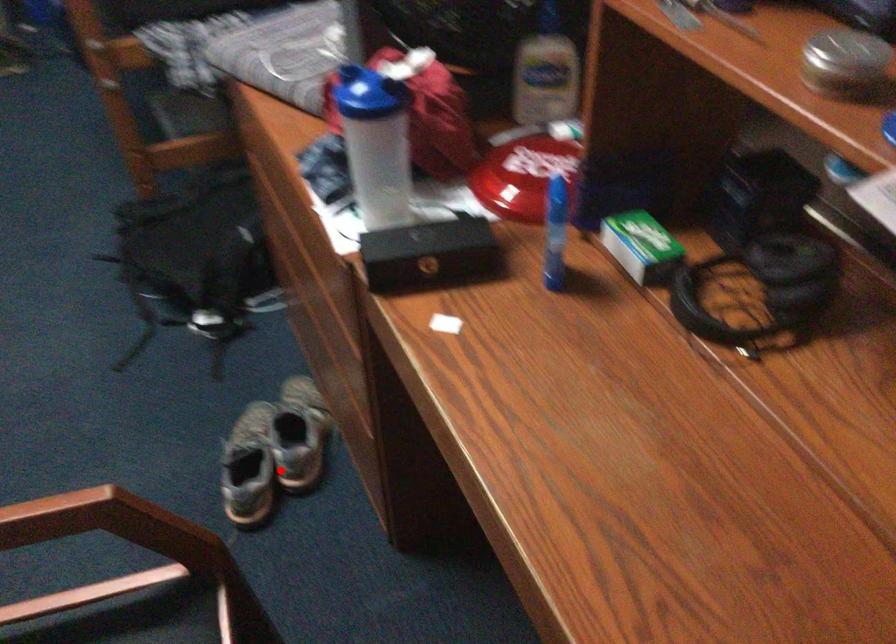
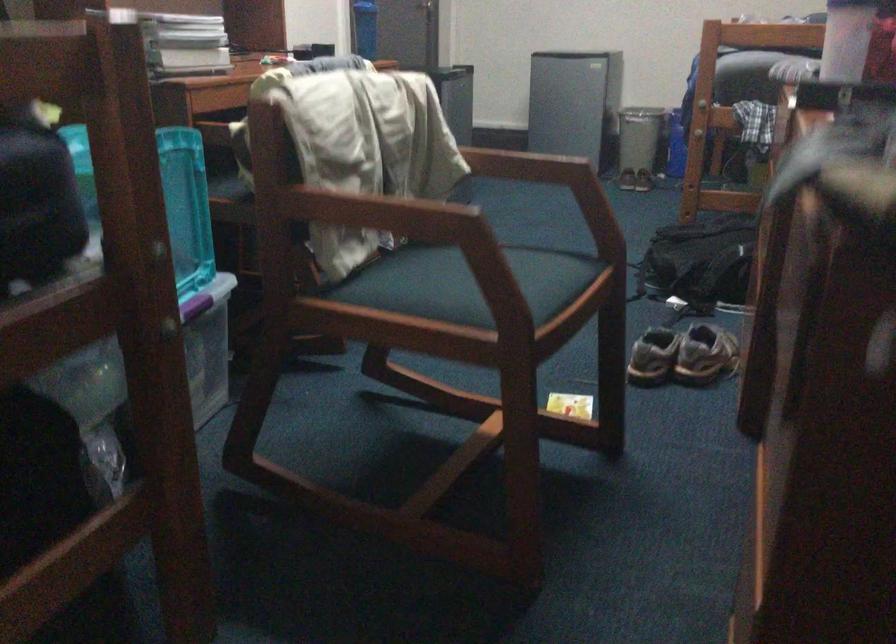
Question: I am providing you with two images of the same scene from different viewpoints. In image1, a red point is highlighted. Considering the same 3D point in image2, which of the following is correct?

Choices:
 (A) It is closer
 (B) It is farther

Answer: (B)